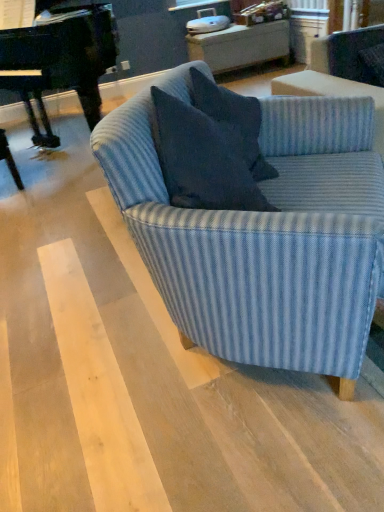
Question: Do you think dark blue fabric pillow at center is within black polished piano at left, or outside of it?

Choices:
 (A) outside
 (B) inside

Answer: (A)

Question: Considering the relative positions of dark blue fabric pillow at center and black polished piano at left in the image provided, is dark blue fabric pillow at center to the left or to the right of black polished piano at left?

Choices:
 (A) right
 (B) left

Answer: (A)

Question: Estimate the real-world distances between objects in this image. Which object is closer to the dark blue fabric pillow at center?

Choices:
 (A) blue striped fabric couch at center
 (B) black polished piano at left
 (C) blue striped fabric swivel chair at upper right

Answer: (A)

Question: Estimate the real-world distances between objects in this image. Which object is farther from the blue striped fabric couch at center?

Choices:
 (A) black polished piano at left
 (B) dark blue fabric pillow at center
 (C) blue striped fabric swivel chair at upper right

Answer: (A)